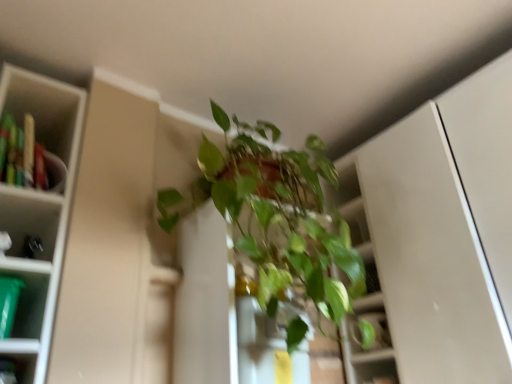
Question: From the image's perspective, does green plastic container at left appear higher than green plastic container at left?

Choices:
 (A) no
 (B) yes

Answer: (A)

Question: Is green plastic container at left oriented towards green plastic container at left?

Choices:
 (A) yes
 (B) no

Answer: (B)

Question: Considering the relative sizes of green plastic container at left and green plastic container at left in the image provided, is green plastic container at left bigger than green plastic container at left?

Choices:
 (A) yes
 (B) no

Answer: (B)

Question: From a real-world perspective, does green plastic container at left sit lower than green plastic container at left?

Choices:
 (A) yes
 (B) no

Answer: (A)

Question: Is green plastic container at left to the right of green plastic container at left from the viewer's perspective?

Choices:
 (A) yes
 (B) no

Answer: (A)

Question: Is green glossy plant at center spatially inside green plastic container at left, or outside of it?

Choices:
 (A) inside
 (B) outside

Answer: (B)

Question: Is green glossy plant at center taller or shorter than green plastic container at left?

Choices:
 (A) short
 (B) tall

Answer: (B)

Question: Based on their positions, is green glossy plant at center located to the left or right of green plastic container at left?

Choices:
 (A) left
 (B) right

Answer: (B)

Question: From the image's perspective, is green glossy plant at center located above or below green plastic container at left?

Choices:
 (A) above
 (B) below

Answer: (A)

Question: In the image, is green plastic container at left positioned in front of or behind green glossy plant at center?

Choices:
 (A) behind
 (B) front

Answer: (A)

Question: Does point (80, 125) appear closer or farther from the camera than point (339, 233)?

Choices:
 (A) farther
 (B) closer

Answer: (B)

Question: In terms of height, does green plastic container at left look taller or shorter compared to green glossy plant at center?

Choices:
 (A) tall
 (B) short

Answer: (B)

Question: From the image's perspective, is green plastic container at left positioned above or below green glossy plant at center?

Choices:
 (A) below
 (B) above

Answer: (B)

Question: From a real-world perspective, relative to green plastic container at left, is green plastic container at left vertically above or below?

Choices:
 (A) below
 (B) above

Answer: (A)

Question: Considering the positions of green plastic container at left and green plastic container at left in the image, is green plastic container at left wider or thinner than green plastic container at left?

Choices:
 (A) wide
 (B) thin

Answer: (A)